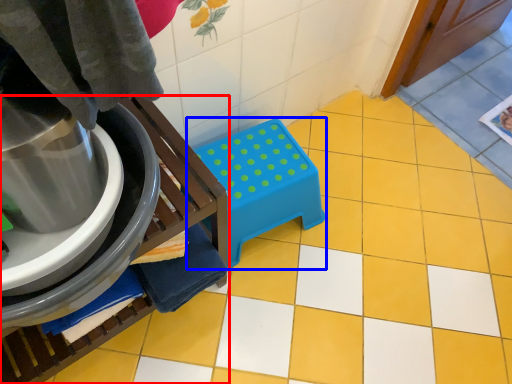
Question: Which object appears farthest to the camera in this image, furniture (highlighted by a red box) or step stool (highlighted by a blue box)?

Choices:
 (A) furniture
 (B) step stool

Answer: (B)